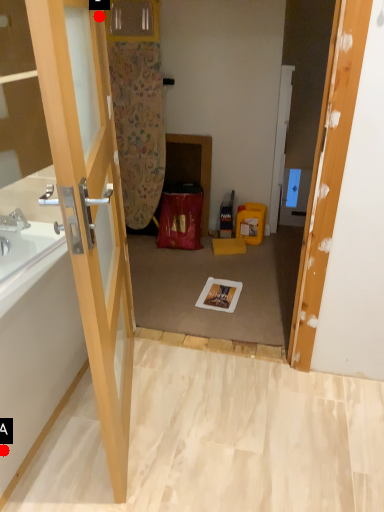
Question: Two points are circled on the image, labeled by A and B beside each circle. Which of the following is the farthest from the observer?

Choices:
 (A) A is further
 (B) B is further

Answer: (A)